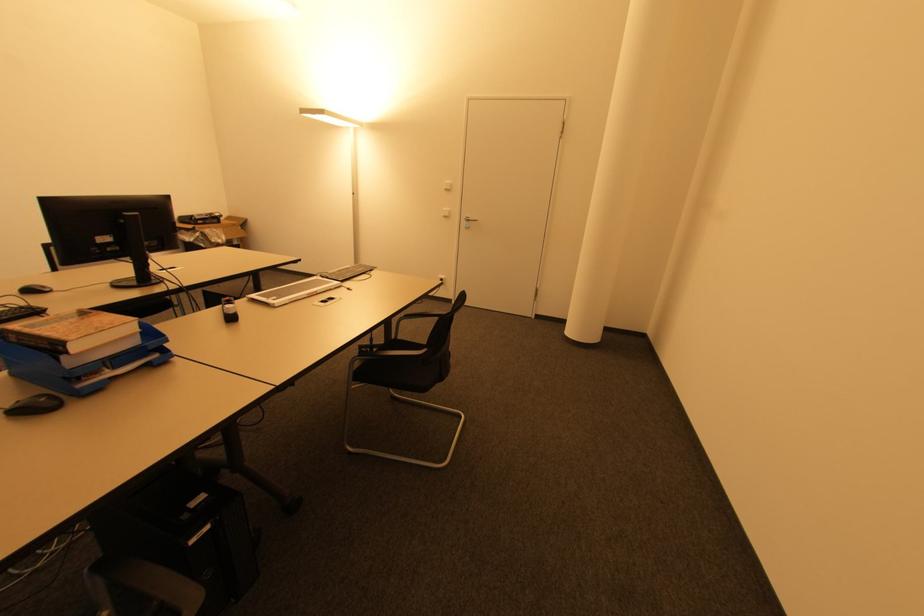
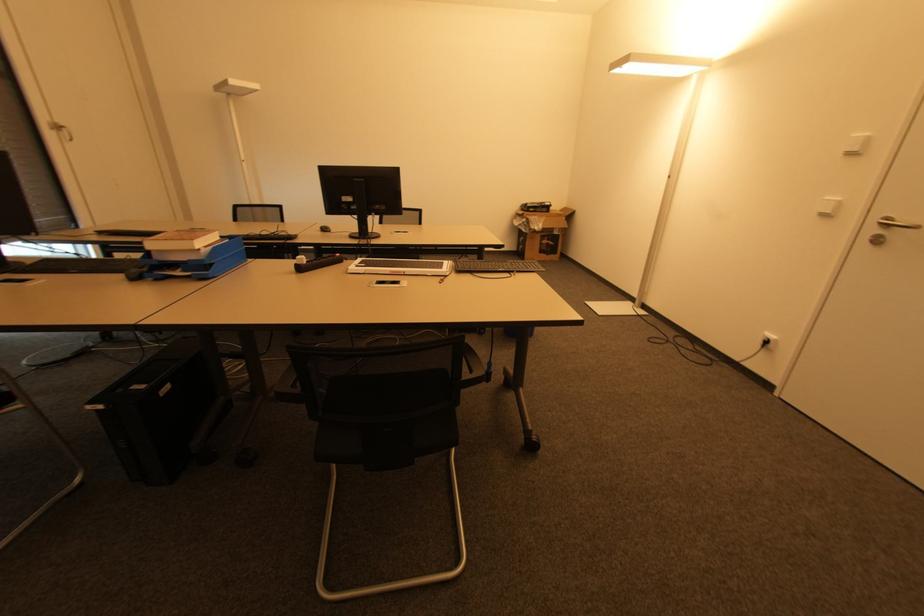
Locate, in the second image, the point that corresponds to (x=448, y=216) in the first image.

(832, 214)